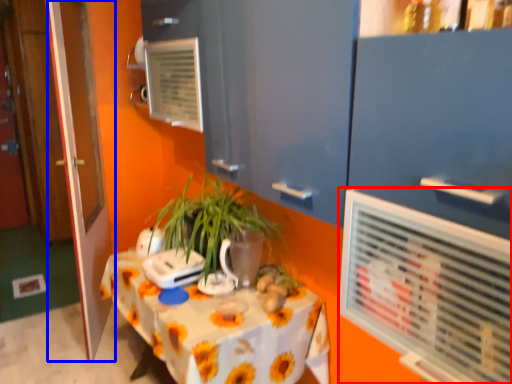
Question: Which point is closer to the camera, air conditioning (highlighted by a red box) or door (highlighted by a blue box)?

Choices:
 (A) air conditioning
 (B) door

Answer: (A)